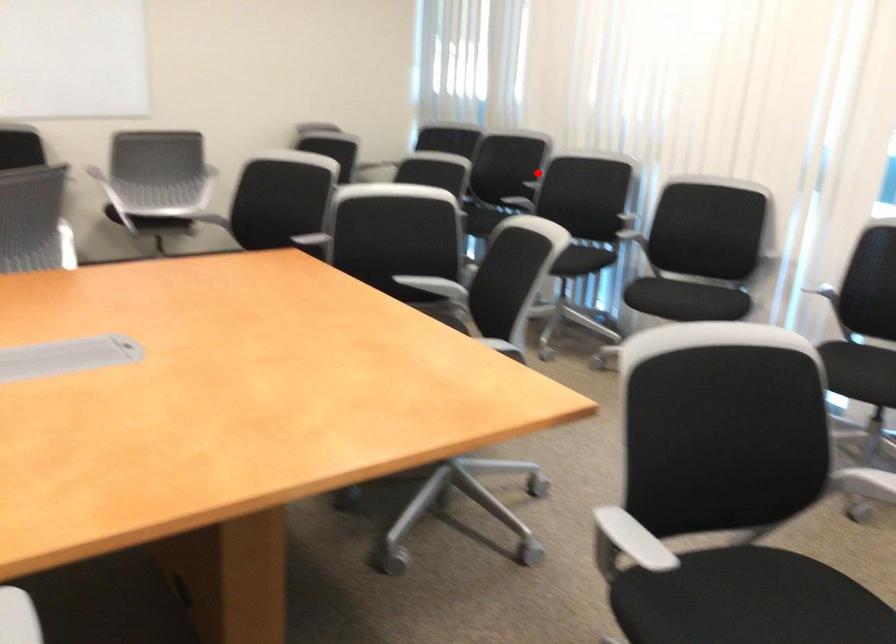
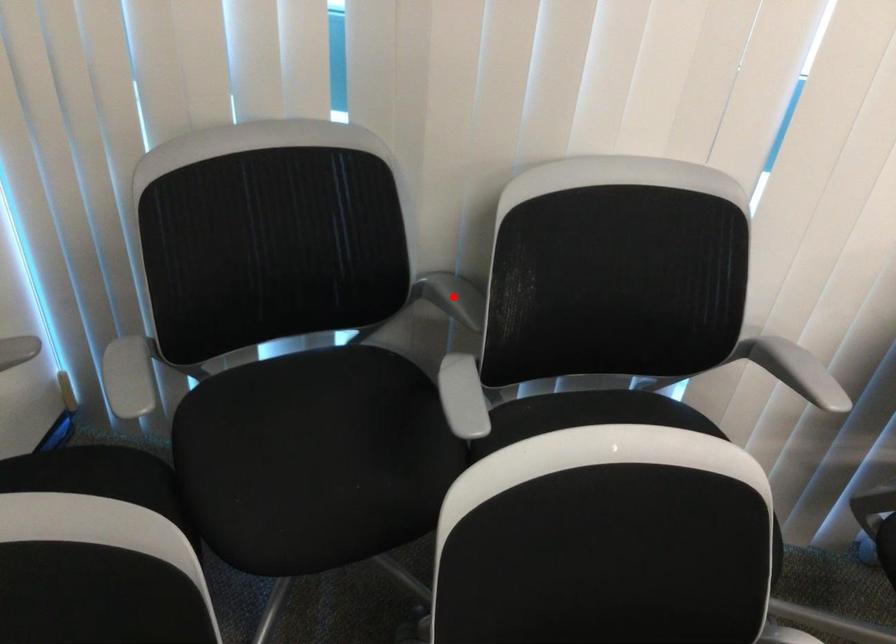
I am providing you with two images of the same scene from different viewpoints. A red point is marked on the first image and another point is marked on the second image. Are the points marked in image1 and image2 representing the same 3D position?

No